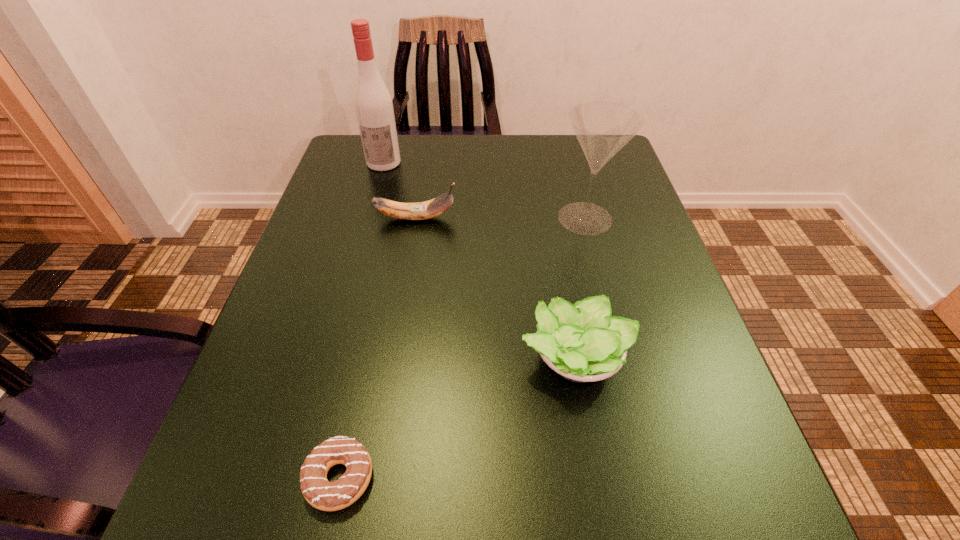
The height and width of the screenshot is (540, 960). In order to click on vacant region located on the peel of the banana in this screenshot , I will do `click(601, 218)`.

Identify the location of vacant space located 0.070m on the left of the fourth tallest object. (474, 358).

I want to click on free region located on the left of the shortest object, so click(221, 478).

Locate an element on the screen. This screenshot has height=540, width=960. object at the far edge is located at coordinates (373, 104).

Where is `object that is at the near edge`? The image size is (960, 540). object that is at the near edge is located at coordinates (320, 493).

I want to click on alcohol present at the left edge, so click(x=373, y=104).

At what (x,y) coordinates should I click in order to perform the action: click on banana that is at the left edge. Please return your answer as a coordinate pair (x, y). Looking at the image, I should click on (429, 209).

Locate an element on the screen. doughnut positioned at the left edge is located at coordinates 320,493.

The image size is (960, 540). In order to click on flute glass at the right edge in this screenshot , I will do `click(602, 128)`.

Locate an element on the screen. This screenshot has height=540, width=960. lettuce present at the right edge is located at coordinates (582, 342).